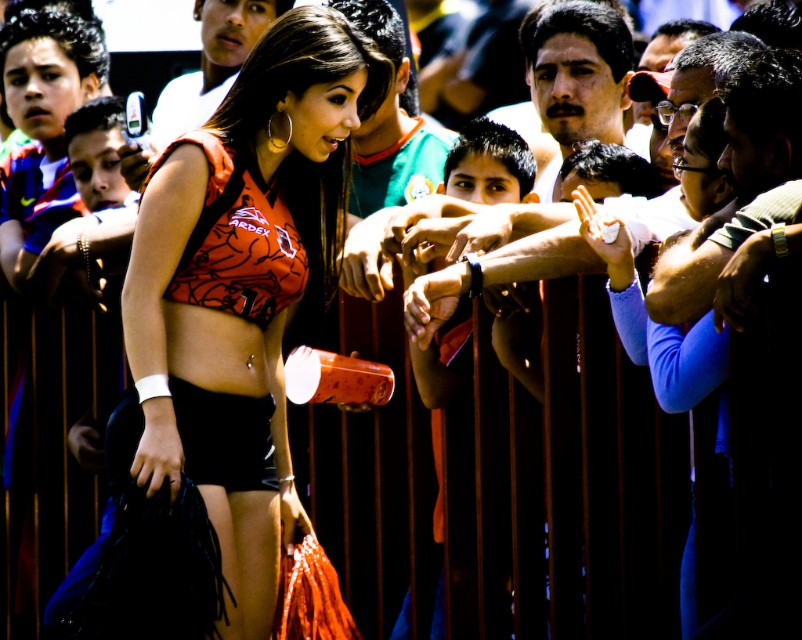
You are a photographer trying to capture a clear shot of the matte orange jersey at center and the orange matte bikini top at center. Since you want to highlight both items equally in your photo, which one should you zoom in on more?

The matte orange jersey at center is bigger than orange matte bikini top at center, so you should zoom in more on the orange matte bikini top at center to balance their sizes in the photo.

Based on the coordinates provided, which object is located at point (240, 291) in the image?

The point (240, 291) corresponds to the matte orange jersey at center.